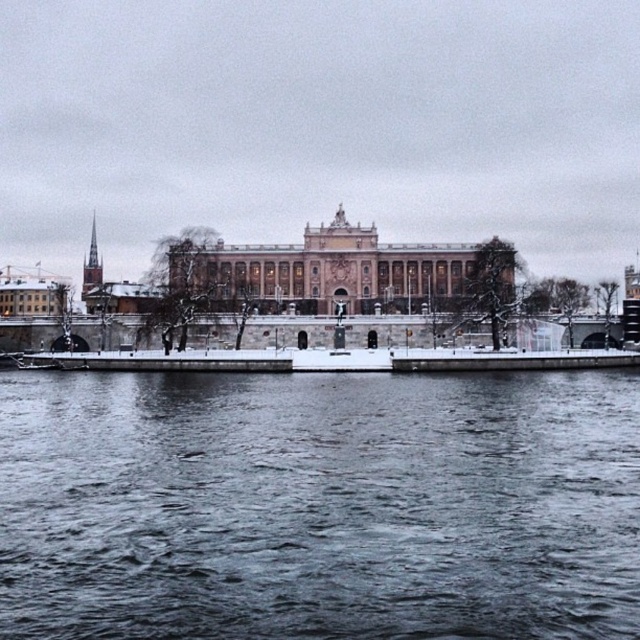
Question: Which point is closer to the camera?

Choices:
 (A) click(124, 515)
 (B) click(276, 292)

Answer: (A)

Question: Can you confirm if dark gray water at lower center is thinner than pink stone building at center?

Choices:
 (A) yes
 (B) no

Answer: (B)

Question: Can you confirm if dark gray water at lower center is wider than pink stone building at center?

Choices:
 (A) no
 (B) yes

Answer: (B)

Question: Which point appears closest to the camera in this image?

Choices:
 (A) (305, 275)
 (B) (381, 584)

Answer: (B)

Question: Can you confirm if dark gray water at lower center is bigger than pink stone building at center?

Choices:
 (A) yes
 (B) no

Answer: (A)